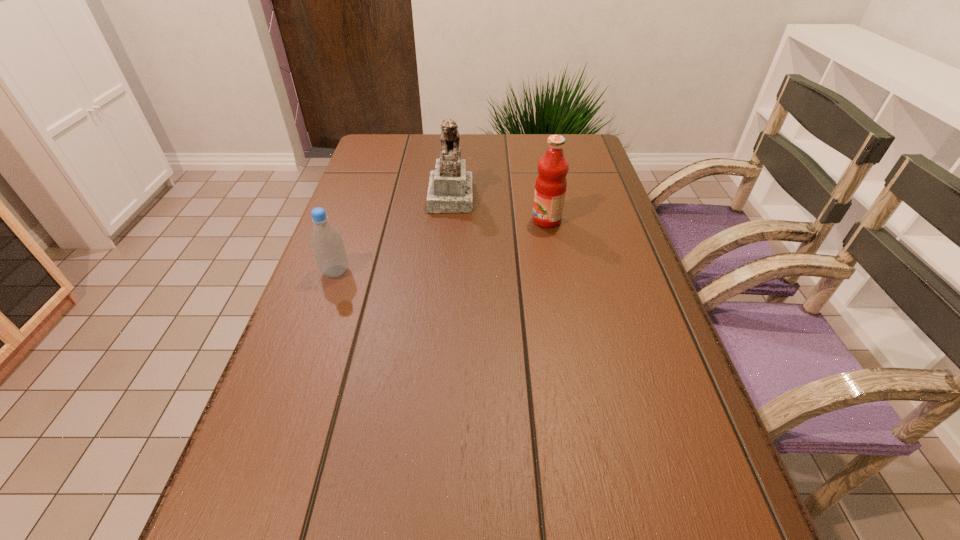
Where is `object positioned at the right edge`? The image size is (960, 540). object positioned at the right edge is located at coordinates (550, 188).

Image resolution: width=960 pixels, height=540 pixels. I want to click on free space at the left edge, so click(313, 338).

Where is `vacant space at the right edge of the desktop`? The height and width of the screenshot is (540, 960). vacant space at the right edge of the desktop is located at coordinates (650, 306).

Identify the location of vacant position at the far left corner of the desktop. The width and height of the screenshot is (960, 540). (402, 151).

Locate an element on the screen. The height and width of the screenshot is (540, 960). vacant space that's between the rightmost object and the leftmost object is located at coordinates (441, 246).

The height and width of the screenshot is (540, 960). I want to click on free area in between the fruit juice and the figurine, so click(498, 208).

Identify the location of free spot between the bottle and the rightmost object. This screenshot has width=960, height=540. (441, 246).

The width and height of the screenshot is (960, 540). I want to click on vacant area between the fruit juice and the figurine, so click(498, 208).

Locate an element on the screen. Image resolution: width=960 pixels, height=540 pixels. free space between the leftmost object and the rightmost object is located at coordinates (441, 246).

Where is `unoccupied position between the second object from right to left and the rightmost object`? unoccupied position between the second object from right to left and the rightmost object is located at coordinates (498, 208).